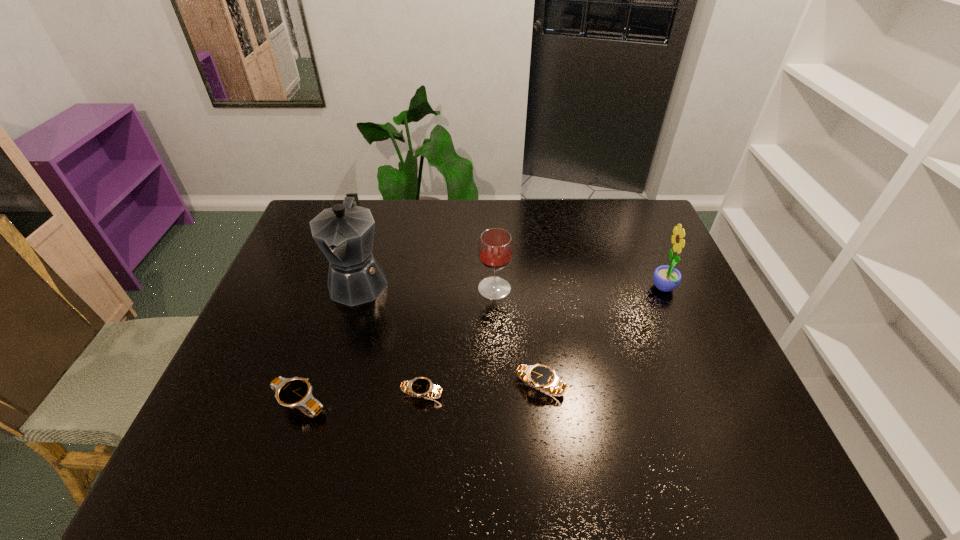
The height and width of the screenshot is (540, 960). What are the coordinates of `vacant space located on the back of the fourth tallest object` in the screenshot? It's located at [324, 329].

At what (x,y) coordinates should I click in order to perform the action: click on free location located 0.330m on the back of the fourth object from right to left. Please return your answer as a coordinate pair (x, y). This screenshot has width=960, height=540. Looking at the image, I should click on (434, 290).

You are a GUI agent. You are given a task and a screenshot of the screen. Output one action in this format:
    pyautogui.click(x=<x>, y=<y>)
    Task: Click on the free space located on the right of the rightmost watch
    This screenshot has width=960, height=540.
    Given the screenshot: What is the action you would take?
    pyautogui.click(x=614, y=386)

I want to click on vacant point located on the right of the wineglass, so click(628, 288).

Where is `vacant space situated at the spout of the tallest object`? The width and height of the screenshot is (960, 540). vacant space situated at the spout of the tallest object is located at coordinates (338, 352).

Locate an element on the screen. vacant space located on the front-facing side of the sunflower is located at coordinates (628, 289).

Where is `vacant space located 0.050m on the front-facing side of the sunflower`? vacant space located 0.050m on the front-facing side of the sunflower is located at coordinates (635, 289).

At what (x,y) coordinates should I click in order to perform the action: click on vacant space located on the front-facing side of the sunflower. Please return your answer as a coordinate pair (x, y). The image size is (960, 540). Looking at the image, I should click on (591, 289).

The width and height of the screenshot is (960, 540). I want to click on object at the left edge, so click(x=295, y=392).

Locate an element on the screen. The width and height of the screenshot is (960, 540). object present at the right edge is located at coordinates (666, 278).